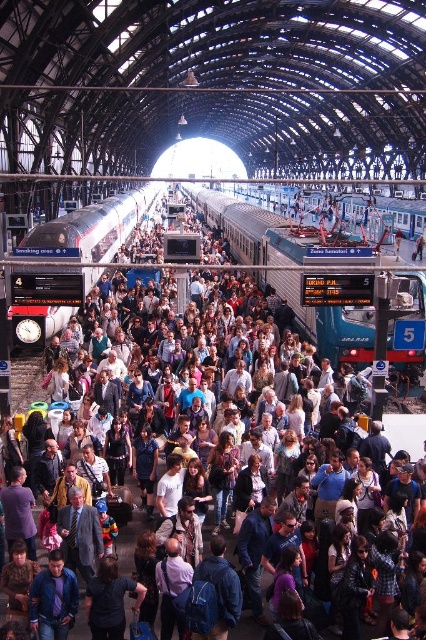
Question: Is teal metallic train at center behind silver metallic train at center?

Choices:
 (A) no
 (B) yes

Answer: (B)

Question: Which of the following is the farthest from the observer?

Choices:
 (A) teal metallic train at center
 (B) silver metallic train at center

Answer: (A)

Question: Which of the following is the farthest from the observer?

Choices:
 (A) (121, 204)
 (B) (362, 324)

Answer: (A)

Question: Observing the image, what is the correct spatial positioning of teal metallic train at center in reference to silver metallic train at center?

Choices:
 (A) below
 (B) above

Answer: (A)

Question: Which point is farther from the camera taking this photo?

Choices:
 (A) (337, 314)
 (B) (71, 268)

Answer: (A)

Question: Does teal metallic train at center appear on the right side of silver metallic train at center?

Choices:
 (A) yes
 (B) no

Answer: (A)